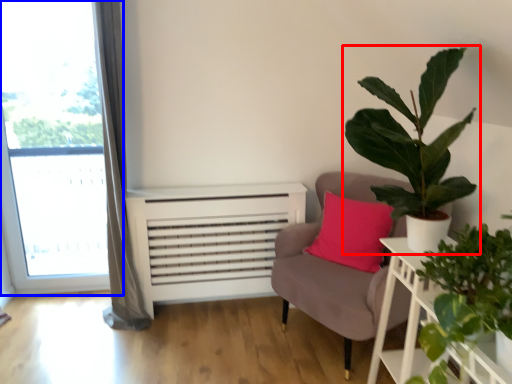
Question: Which object is further to the camera taking this photo, houseplant (highlighted by a red box) or window (highlighted by a blue box)?

Choices:
 (A) houseplant
 (B) window

Answer: (B)